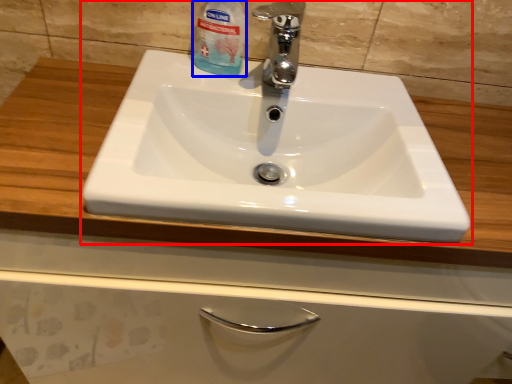
Question: Which object appears closest to the camera in this image, sink (highlighted by a red box) or cleaning product (highlighted by a blue box)?

Choices:
 (A) sink
 (B) cleaning product

Answer: (A)